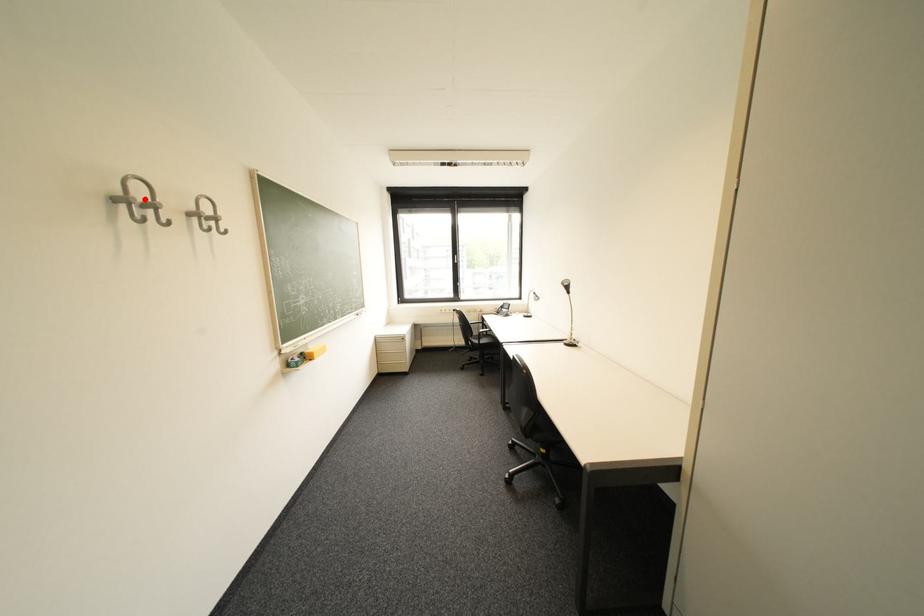
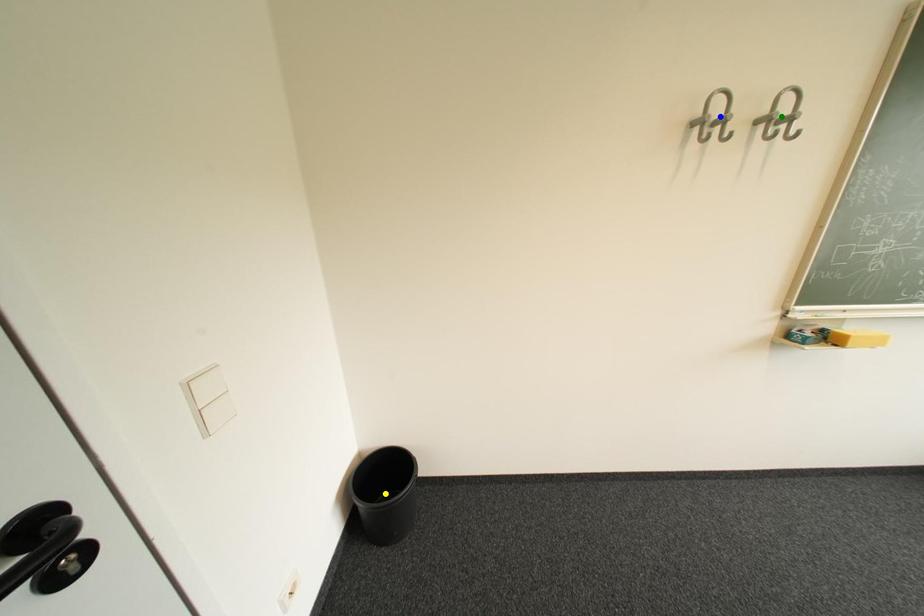
Question: I am providing you with two images of the same scene from different viewpoints. A red point is marked on the first image. You are given multiple points on the second image. Which point in image 2 represents the same 3d spot as the red point in image 1?

Choices:
 (A) blue point
 (B) yellow point
 (C) green point

Answer: (A)